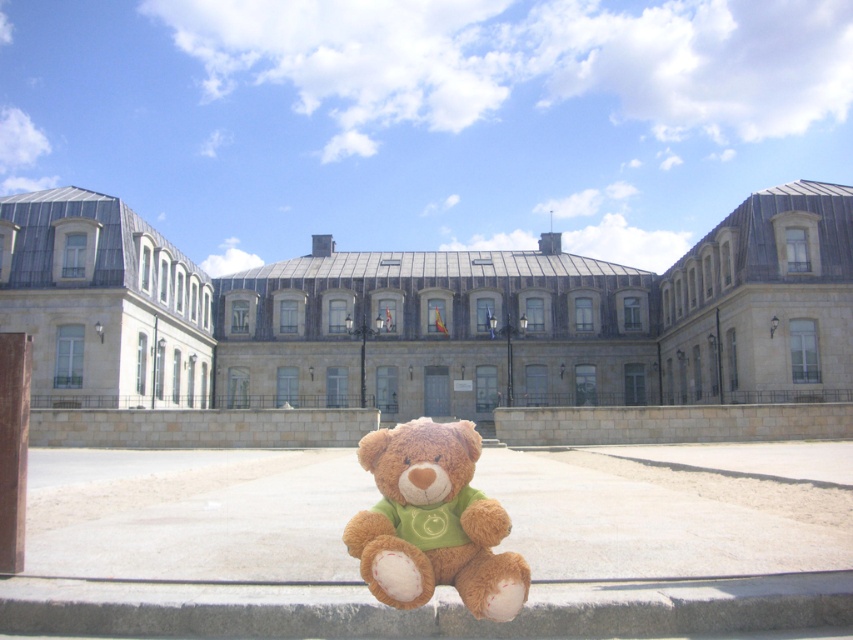
Question: Can you confirm if stone building at center is positioned to the right of soft brown teddy bear at center?

Choices:
 (A) yes
 (B) no

Answer: (B)

Question: Which of the following is the closest to the observer?

Choices:
 (A) stone building at center
 (B) soft brown teddy bear at center

Answer: (B)

Question: Which of the following is the farthest from the observer?

Choices:
 (A) (764, 387)
 (B) (469, 602)

Answer: (A)

Question: Can you confirm if stone building at center is positioned above soft brown teddy bear at center?

Choices:
 (A) no
 (B) yes

Answer: (B)

Question: Is stone building at center above soft brown teddy bear at center?

Choices:
 (A) no
 (B) yes

Answer: (B)